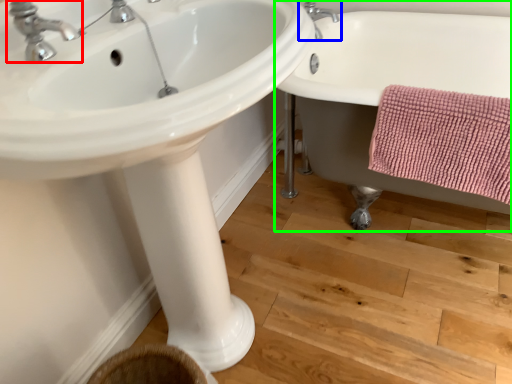
Question: Estimate the real-world distances between objects in this image. Which object is farther from tap (highlighted by a red box), tap (highlighted by a blue box) or bathtub (highlighted by a green box)?

Choices:
 (A) tap
 (B) bathtub

Answer: (A)